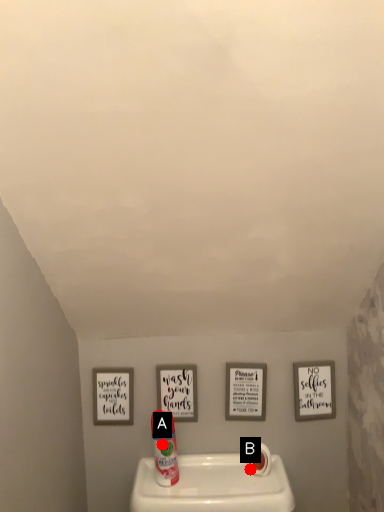
Question: Two points are circled on the image, labeled by A and B beside each circle. Which of the following is the farthest from the observer?

Choices:
 (A) A is further
 (B) B is further

Answer: (B)